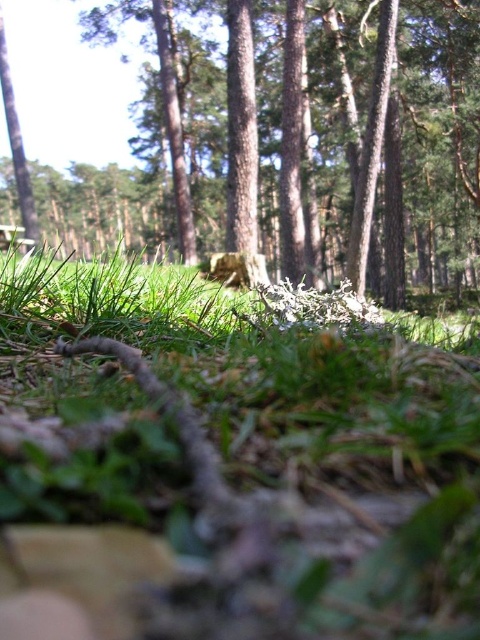
You are a hiker who wants to place a 2 meter long tent between the green grass at center and the rough bark tree at center. Is there enough space to set up the tent without it touching either object?

The distance between the green grass at center and the rough bark tree at center is 6.85 meters. Since the tent is only 2 meters long, there is sufficient space to set it up between them without touching either object.

Looking at this image, you are a photographer standing at the camera position in the forest scene. You want to place a small marker at each of the two points, point (146,458) and point (126,221). Which marker will appear larger in your photo?

Point (146,458) is closer to the camera than point (126,221), so the marker placed at point (146,458) will appear larger in the photo.